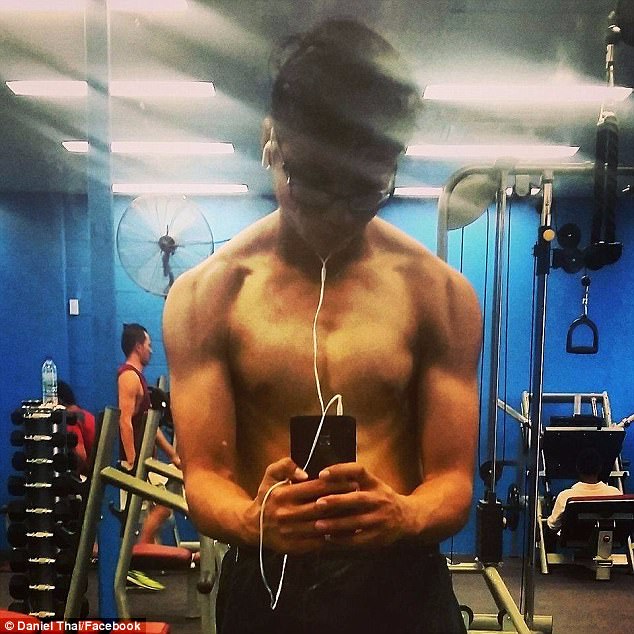
In order to click on rack of black dumbbells in this screenshot , I will do `click(39, 505)`.